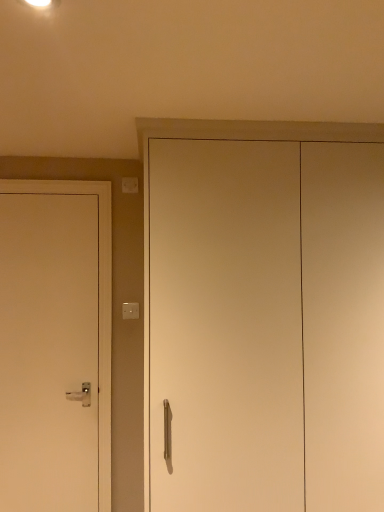
Question: Does white matte cabinet at center, which is counted as the second door, starting from the back, have a lesser height compared to white plastic light switch at upper center, arranged as the 2th light switch when viewed from the top?

Choices:
 (A) no
 (B) yes

Answer: (A)

Question: Can you confirm if white matte cabinet at center, which is counted as the second door, starting from the back, is positioned to the right of white plastic light switch at upper center, the first light switch ordered from the bottom?

Choices:
 (A) yes
 (B) no

Answer: (A)

Question: Is white matte cabinet at center, which is counted as the first door, starting from the front, to the left of white plastic light switch at upper center, arranged as the 2th light switch when viewed from the top, from the viewer's perspective?

Choices:
 (A) yes
 (B) no

Answer: (B)

Question: Does white matte cabinet at center, arranged as the second door when viewed from the left, contain white plastic light switch at upper center, the first light switch ordered from the bottom?

Choices:
 (A) no
 (B) yes

Answer: (A)

Question: Can we say white matte cabinet at center, which is the first door in right-to-left order, lies outside white plastic light switch at upper center, arranged as the 2th light switch when viewed from the top?

Choices:
 (A) yes
 (B) no

Answer: (A)

Question: Is white matte cabinet at center, which is counted as the first door, starting from the front, bigger or smaller than white matte door at left, which is counted as the first door, starting from the back?

Choices:
 (A) big
 (B) small

Answer: (A)

Question: Is point coord(210,490) closer or farther from the camera than point coord(11,428)?

Choices:
 (A) farther
 (B) closer

Answer: (B)

Question: In the image, is white matte cabinet at center, which is counted as the second door, starting from the back, positioned in front of or behind white matte door at left, which ranks as the 2th door in right-to-left order?

Choices:
 (A) behind
 (B) front

Answer: (B)

Question: From a real-world perspective, is white matte cabinet at center, which is counted as the first door, starting from the front, positioned above or below white matte door at left, acting as the 2th door starting from the front?

Choices:
 (A) above
 (B) below

Answer: (A)

Question: In the image, is white plastic light switch at upper left, acting as the 2th light switch starting from the bottom, positioned in front of or behind white matte door at left, which ranks as the 2th door in right-to-left order?

Choices:
 (A) front
 (B) behind

Answer: (B)

Question: In terms of size, does white plastic light switch at upper left, the first light switch from the top, appear bigger or smaller than white matte door at left, acting as the 2th door starting from the front?

Choices:
 (A) big
 (B) small

Answer: (B)

Question: From the image's perspective, is white plastic light switch at upper left, acting as the 2th light switch starting from the bottom, positioned above or below white matte door at left, which is counted as the first door, starting from the back?

Choices:
 (A) above
 (B) below

Answer: (A)

Question: From a real-world perspective, is white plastic light switch at upper left, acting as the 2th light switch starting from the bottom, above or below white matte door at left, which is counted as the first door, starting from the back?

Choices:
 (A) below
 (B) above

Answer: (B)

Question: From the image's perspective, is white matte door at left, which is the first door in left-to-right order, positioned above or below white matte cabinet at center, which is counted as the first door, starting from the front?

Choices:
 (A) below
 (B) above

Answer: (A)

Question: Visually, is white matte door at left, which ranks as the 2th door in right-to-left order, positioned to the left or to the right of white matte cabinet at center, which is counted as the second door, starting from the back?

Choices:
 (A) right
 (B) left

Answer: (B)